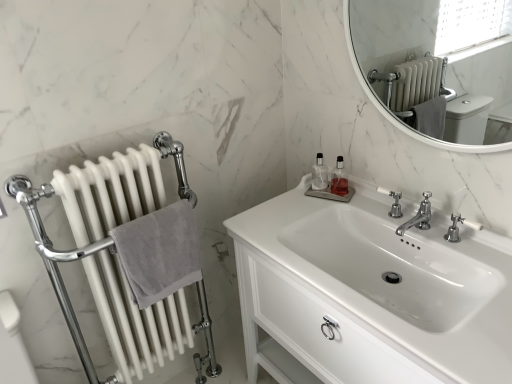
This screenshot has width=512, height=384. What are the coordinates of `vacant region to the left of clear glass bottle at upper center, marked as the first toiletry in a left-to-right arrangement` in the screenshot? It's located at (288, 201).